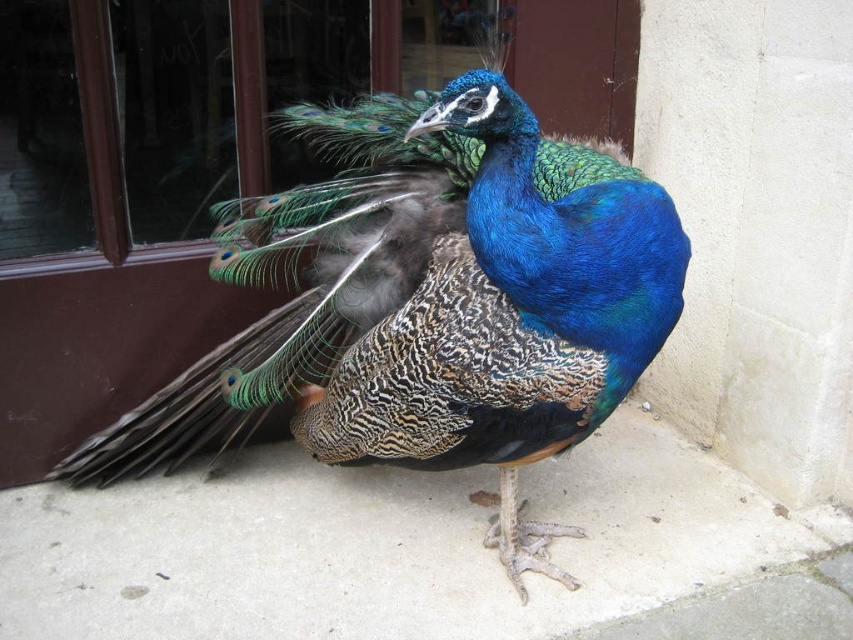
You are a photographer wanting to capture the shiny blue peacock at center and the smooth concrete pavement at lower center in a single frame. Based on their positions, which object should you focus on first to ensure both are in the shot?

The shiny blue peacock at center is positioned on the left side of smooth concrete pavement at lower center. Therefore, you should focus on the shiny blue peacock at center first to ensure both are in the shot since it is closer to the left edge of the frame.

You are a photographer trying to capture the shiny blue peacock at center. You notice the smooth concrete pavement at lower center in your shot. Since the peacock is larger, where should you position the camera to ensure the peacock fills the frame without cropping the pavement?

The shiny blue peacock at center is bigger than the smooth concrete pavement at lower center, so you should move the camera closer to the peacock to make it fill the frame while keeping the pavement out of the shot.